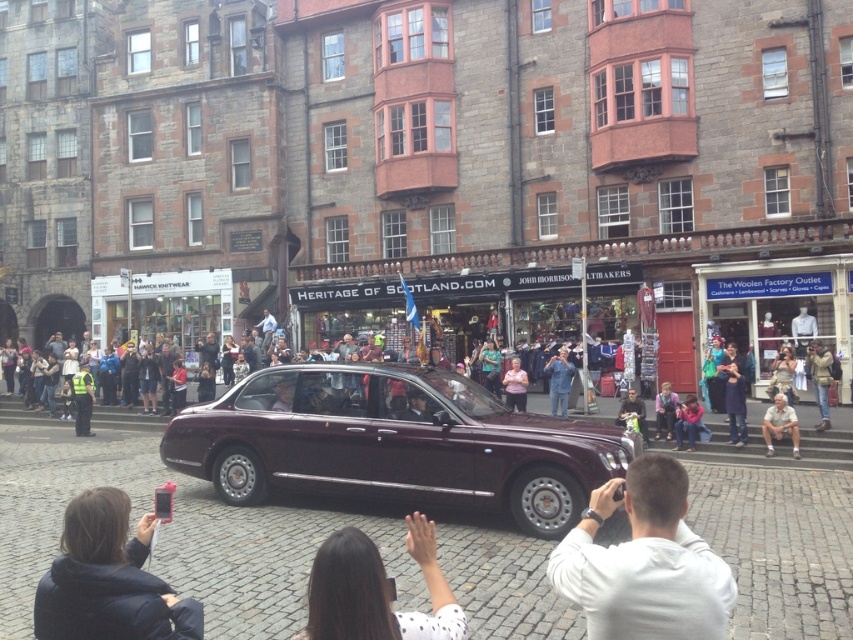
You are a photographer standing at the corner of the street. You need to capture a photo that includes both the dark blue jacket at lower left and the pink fabric at center without any obstruction. Given their positions and heights, which object should you focus on first to ensure both are in frame?

The dark blue jacket at lower left has a lesser height compared to pink fabric at center. To ensure both are in frame without obstruction, focus on positioning the camera so the pink fabric at center is visible first, then adjust to include the lower dark blue jacket at lower left.

You are a photographer standing at the center of the street. You want to take a photo of the dark blue jacket at lower left. Which direction should you turn to face the jacket?

You should turn to your left to face the dark blue jacket at lower left since it is located at the lower left position from your current viewpoint.

You are standing at the point marked by the coordinates in the image. You want to move towards the direction of the car. Which coordinate, point (x=70, y=524) or point (x=78, y=420), is closer to you as you move forward?

Point (x=70, y=524) is closer to the viewer than point (x=78, y=420), so as you move forward towards the car, point (x=70, y=524) will be closer to you.